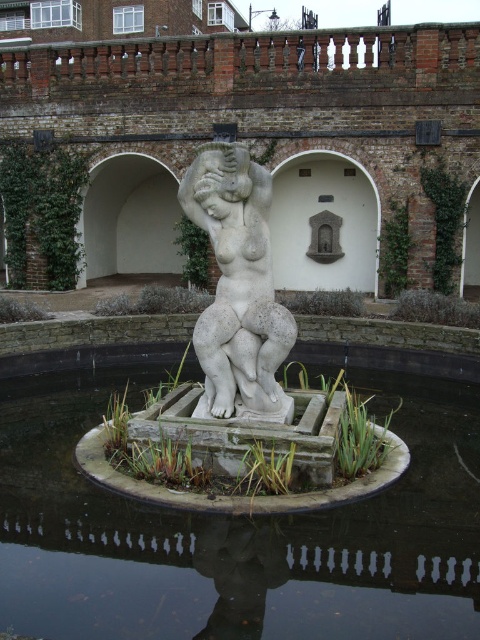
Question: Which object appears closest to the camera in this image?

Choices:
 (A) white stone statue at center
 (B) white stone water at center

Answer: (B)

Question: Is white stone water at center to the left of white stone statue at center from the viewer's perspective?

Choices:
 (A) no
 (B) yes

Answer: (B)

Question: Does white stone water at center appear on the left side of white stone statue at center?

Choices:
 (A) yes
 (B) no

Answer: (A)

Question: Does white stone water at center appear under white stone statue at center?

Choices:
 (A) yes
 (B) no

Answer: (A)

Question: Among these points, which one is nearest to the camera?

Choices:
 (A) (264, 316)
 (B) (351, 536)

Answer: (B)